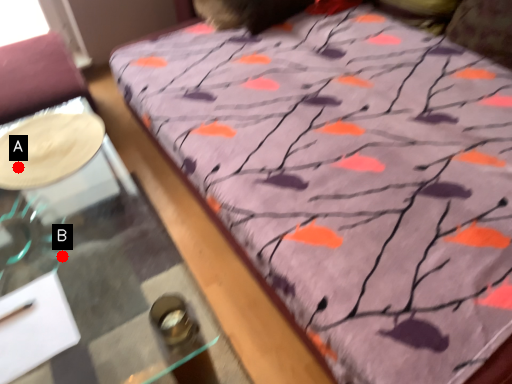
Question: Two points are circled on the image, labeled by A and B beside each circle. Which point is closer to the camera?

Choices:
 (A) A is closer
 (B) B is closer

Answer: (A)